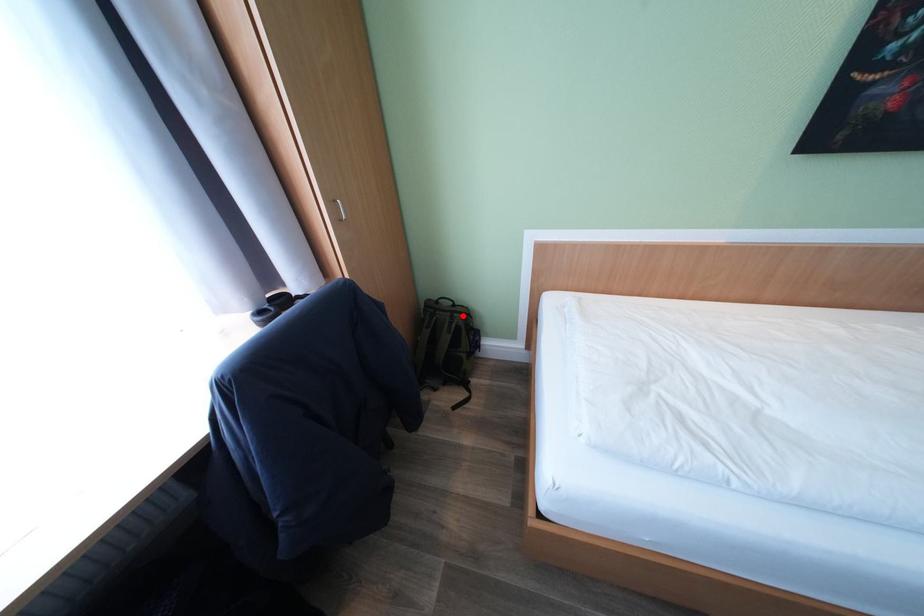
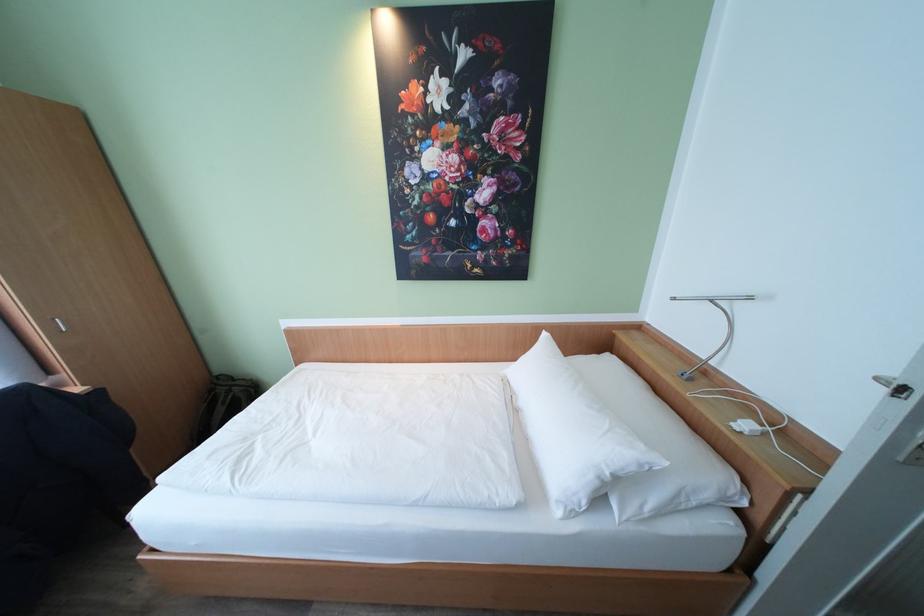
Where in the second image is the point corresponding to the highlighted location from the first image?

(241, 389)